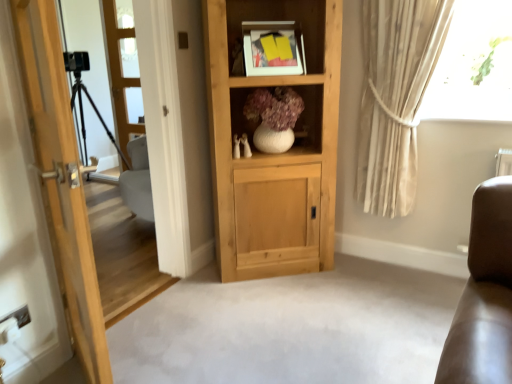
Question: Is natural wood cabinet at center aimed at clear glass door at left, positioned as the 2th screen door in left-to-right order?

Choices:
 (A) no
 (B) yes

Answer: (A)

Question: Considering the relative sizes of natural wood cabinet at center and clear glass door at left, the 1th screen door when ordered from right to left, in the image provided, is natural wood cabinet at center bigger than clear glass door at left, the 1th screen door when ordered from right to left,?

Choices:
 (A) no
 (B) yes

Answer: (B)

Question: Is natural wood cabinet at center not near clear glass door at left, positioned as the 2th screen door in left-to-right order?

Choices:
 (A) yes
 (B) no

Answer: (A)

Question: Is natural wood cabinet at center thinner than clear glass door at left, the 1th screen door when ordered from right to left?

Choices:
 (A) no
 (B) yes

Answer: (A)

Question: Considering the relative sizes of natural wood cabinet at center and clear glass door at left, the 1th screen door when ordered from right to left, in the image provided, is natural wood cabinet at center wider than clear glass door at left, the 1th screen door when ordered from right to left,?

Choices:
 (A) no
 (B) yes

Answer: (B)

Question: Is black matte tripod at left, which appears as the 1th screen door when viewed from the left, to the left or to the right of beige fabric curtain at upper right in the image?

Choices:
 (A) right
 (B) left

Answer: (B)

Question: Considering the positions of black matte tripod at left, acting as the 2th screen door starting from the right, and beige fabric curtain at upper right in the image, is black matte tripod at left, acting as the 2th screen door starting from the right, taller or shorter than beige fabric curtain at upper right?

Choices:
 (A) tall
 (B) short

Answer: (A)

Question: Is black matte tripod at left, which appears as the 1th screen door when viewed from the left, situated inside beige fabric curtain at upper right or outside?

Choices:
 (A) outside
 (B) inside

Answer: (A)

Question: Does point coord(130,304) appear closer or farther from the camera than point coord(411,152)?

Choices:
 (A) closer
 (B) farther

Answer: (A)

Question: In terms of height, does light wood door at left look taller or shorter compared to white matte vase at center?

Choices:
 (A) tall
 (B) short

Answer: (A)

Question: From the image's perspective, is light wood door at left located above or below white matte vase at center?

Choices:
 (A) above
 (B) below

Answer: (B)

Question: In terms of width, does light wood door at left look wider or thinner when compared to white matte vase at center?

Choices:
 (A) thin
 (B) wide

Answer: (A)

Question: From a real-world perspective, relative to white matte vase at center, is light wood door at left vertically above or below?

Choices:
 (A) below
 (B) above

Answer: (A)

Question: In terms of height, does light wood door at left look taller or shorter compared to matte white picture frame at upper center?

Choices:
 (A) short
 (B) tall

Answer: (B)

Question: From the image's perspective, is light wood door at left located above or below matte white picture frame at upper center?

Choices:
 (A) below
 (B) above

Answer: (A)